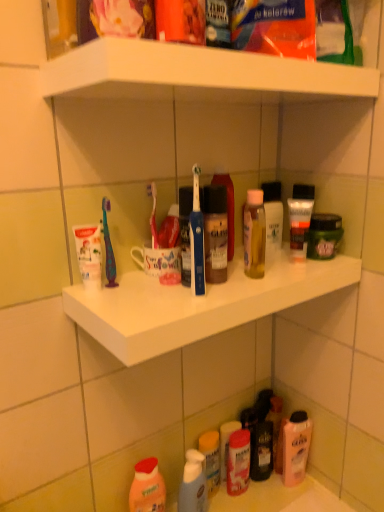
You are a GUI agent. You are given a task and a screenshot of the screen. Output one action in this format:
    pyautogui.click(x=<x>, y=<y>)
    Task: Click on the free spot below white glossy shelf at upper center (from a real-world perspective)
    The image size is (384, 512).
    Given the screenshot: What is the action you would take?
    pyautogui.click(x=226, y=274)